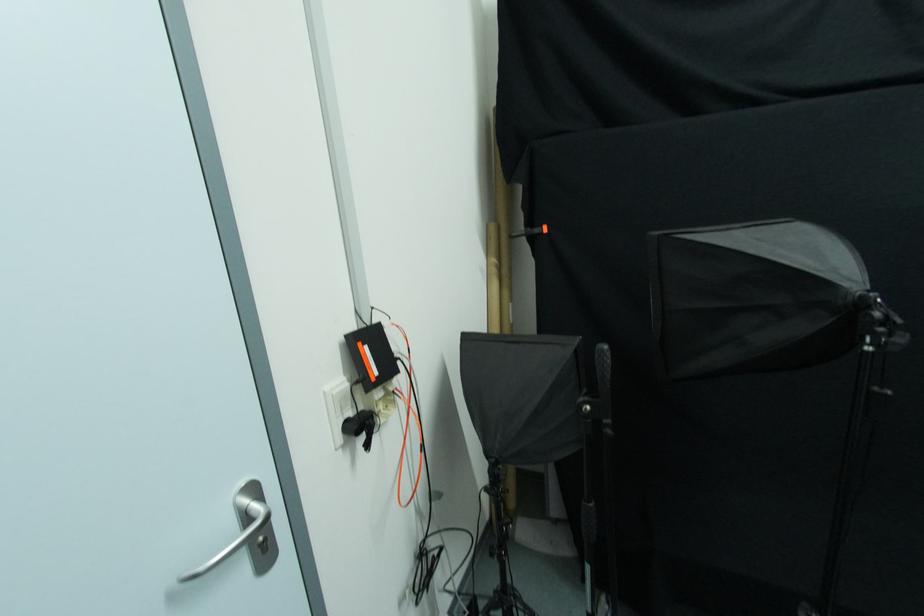
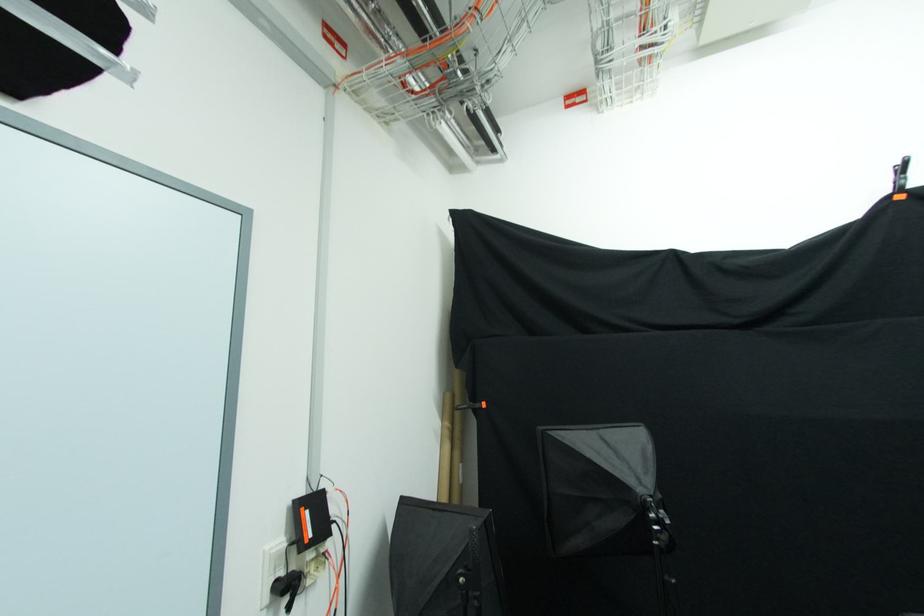
Where in the second image is the point corresponding to (353,416) from the first image?

(285, 577)